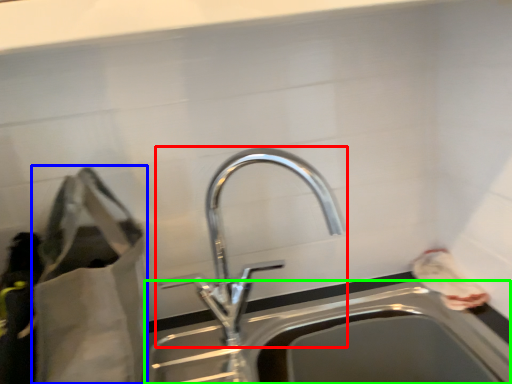
Question: Which is nearer to the tap (highlighted by a red box)? bag (highlighted by a blue box) or sink (highlighted by a green box).

Choices:
 (A) bag
 (B) sink

Answer: (B)